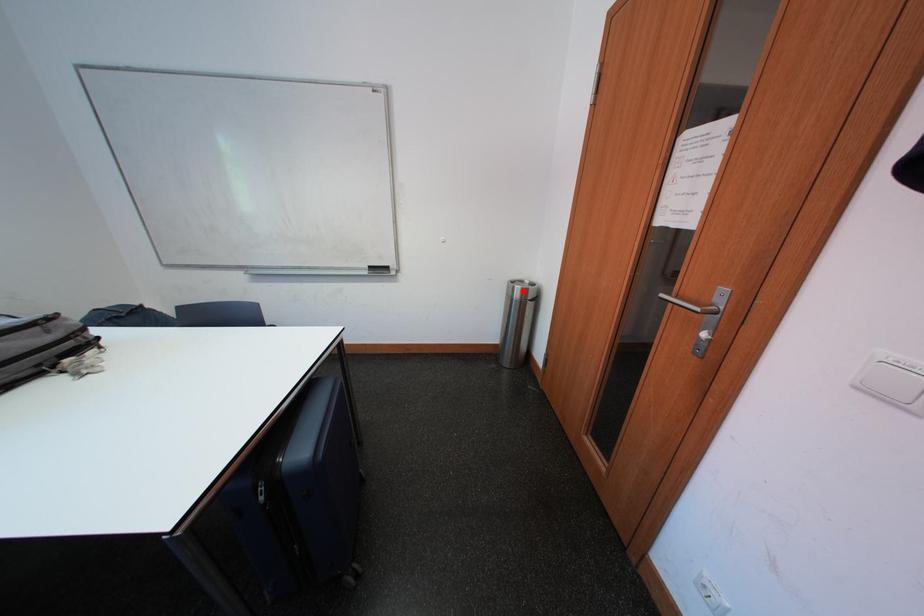
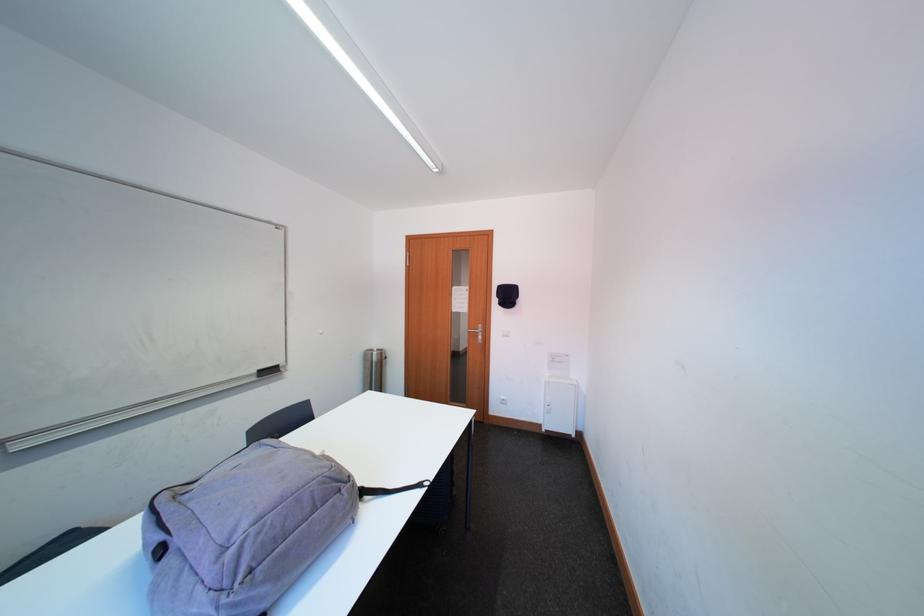
In the second image, find the point that corresponds to the highlighted location in the first image.

(382, 358)